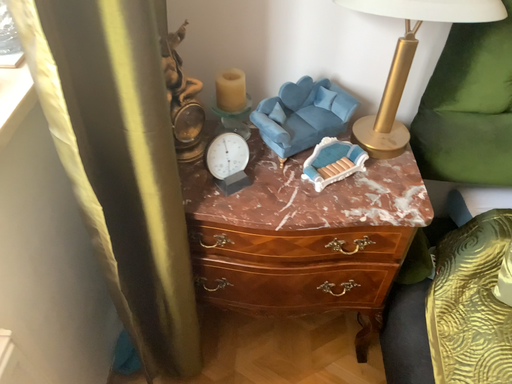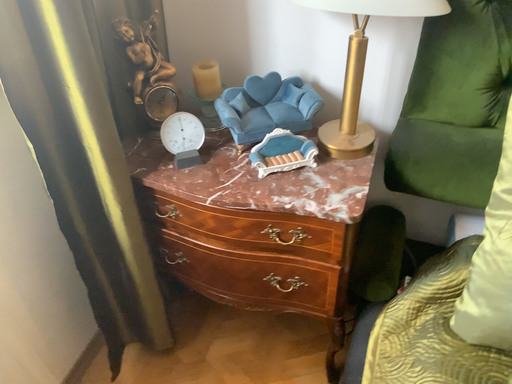
Question: How did the camera likely rotate when shooting the video?

Choices:
 (A) rotated left
 (B) rotated right

Answer: (A)